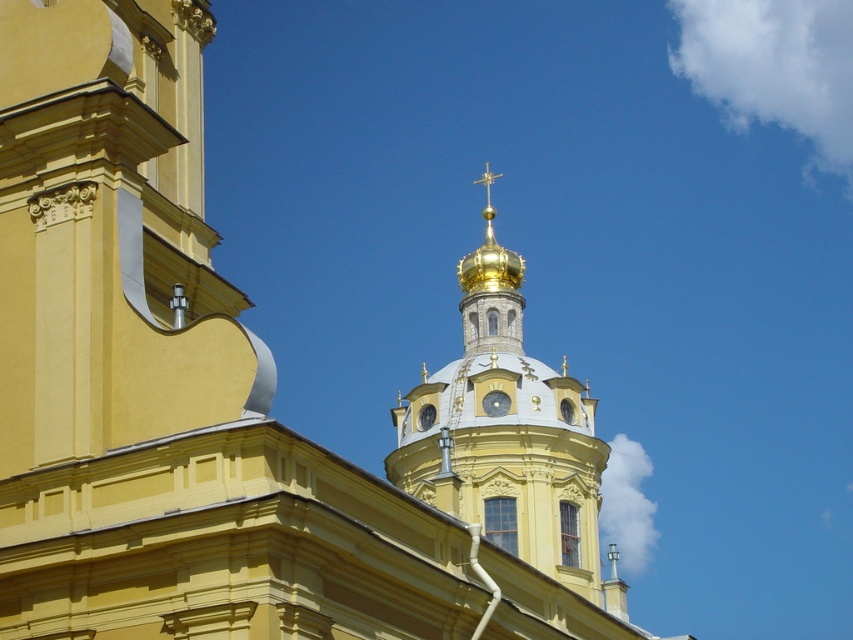
You are a maintenance worker who needs to inspect both the gold plated dome at center and the silver metallic clock at center. If your ladder can extend up to 10 meters, can you safely reach both objects with the same ladder?

The distance between the gold plated dome at center and the silver metallic clock at center is 10.20 meters. Since the ladder can only extend up to 10 meters, it is 20 centimeters too short to reach both objects with the same ladder.

You are an architect examining the cathedral facade. You notice the gold plated dome at center and the silver metallic clock at center. From your vantage point, which object is positioned to the right?

The silver metallic clock at center is positioned to the right of the gold plated dome at center.